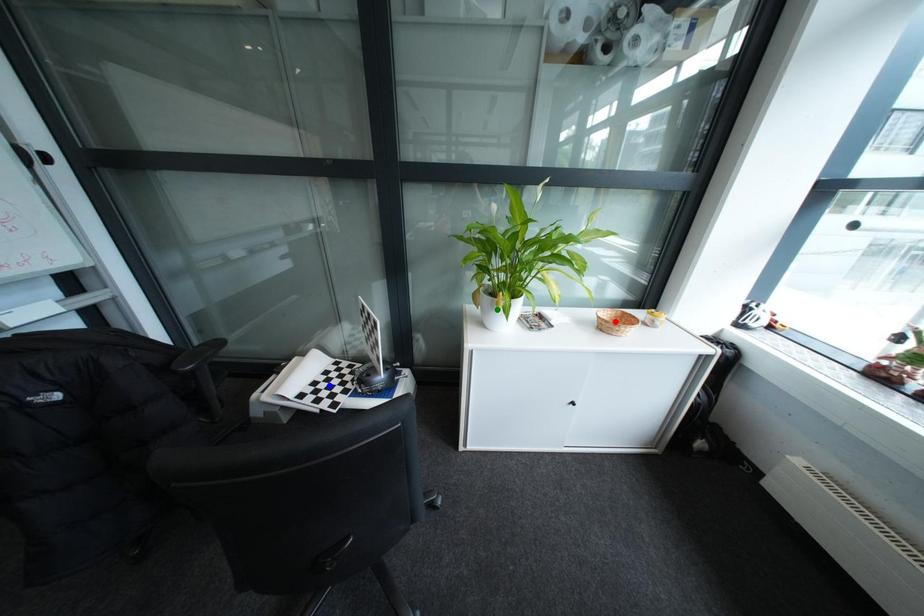
Order these from nearest to farthest:
1. blue point
2. green point
3. red point

green point → red point → blue point